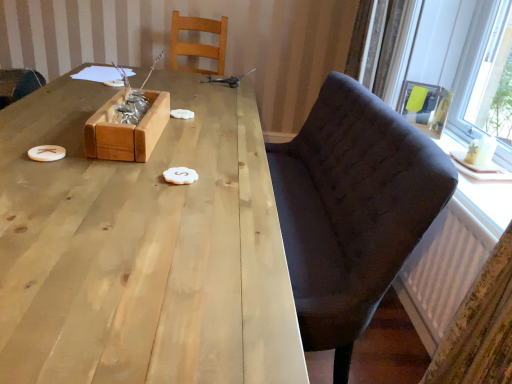
The image size is (512, 384). In order to click on vacant area in front of wooden box at center in this screenshot , I will do `click(104, 177)`.